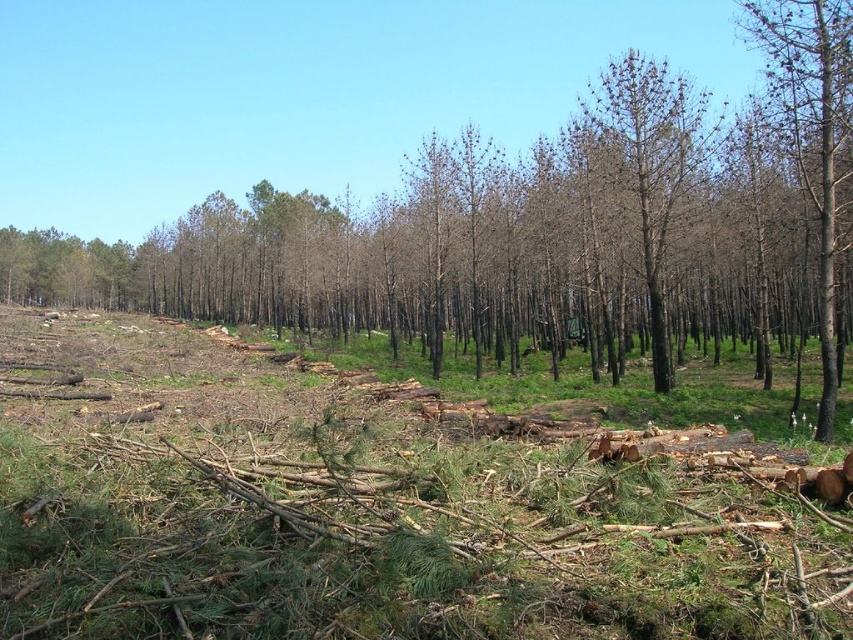
You are a park ranger assessing the forest damage. You notice two brown bark trees remaining in the area. Which tree has a larger width between the brown bark tree at right and the brown bark tree at center?

The brown bark tree at right has a larger width than the brown bark tree at center as stated in the objects description.

You are a forest ranger observing the logging site. You notice two trees at the center of the image labeled as brown wood tree at center and brown bark tree at center. Which one would appear larger in your field of view?

The brown wood tree at center appears larger in your field of view because it is closer to you than the brown bark tree at center.